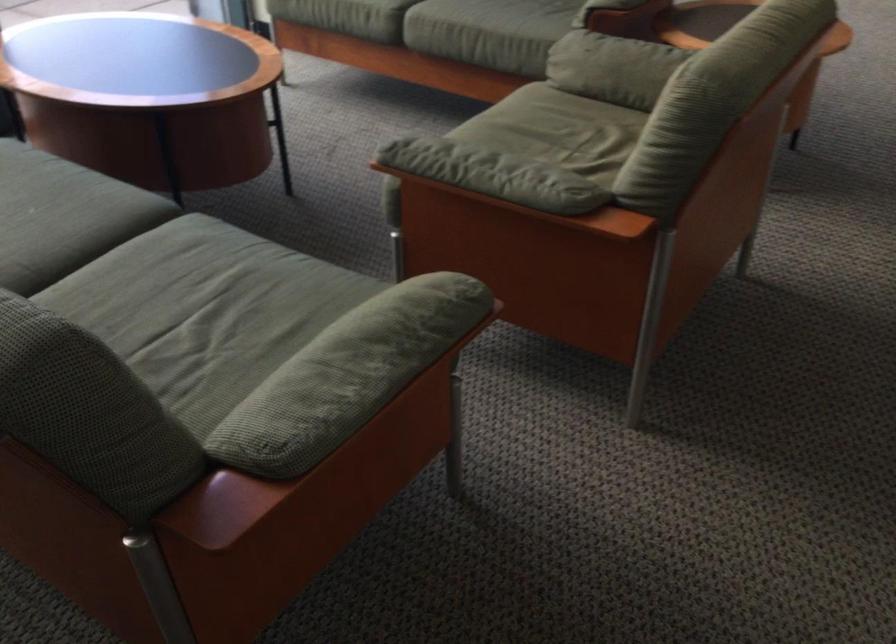
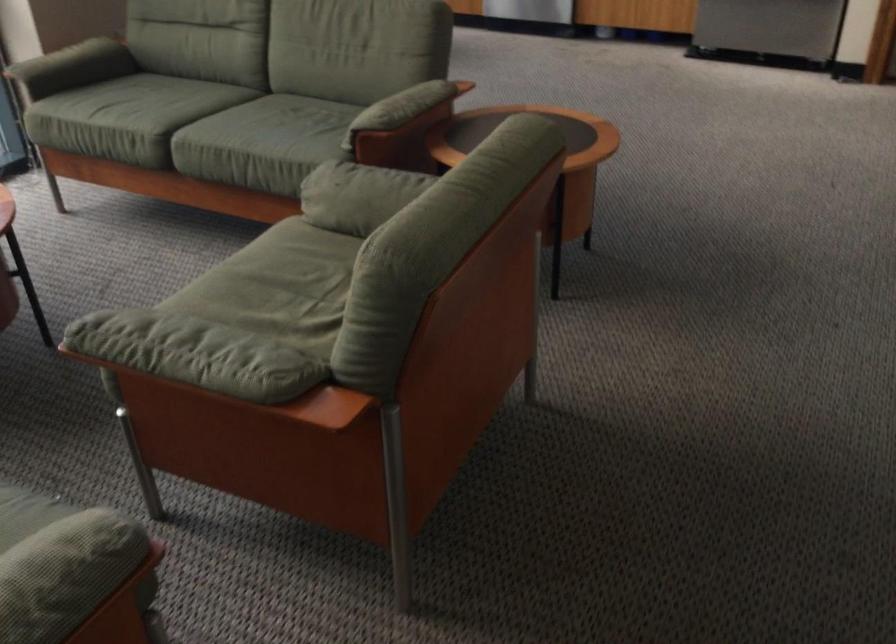
In a continuous first-person perspective shot, in which direction is the camera moving?

The cameraman walked toward right, forward.